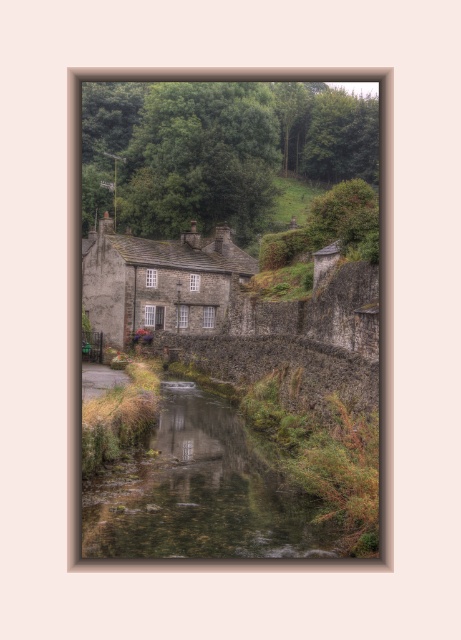
You are standing at the edge of the clear water stream at center and want to reach the rustic stone cottage at center. Which direction should you head to move towards the cottage?

The clear water stream at center is positioned on the right side of rustic stone cottage at center. To reach the cottage, you should move to the left from the stream.

You are standing at the edge of the clear water stream at center. You want to reach the rustic stone cottage at center. Which direction should you head towards?

The clear water stream at center is located below the rustic stone cottage at center, so you should head upwards to reach the rustic stone cottage at center.

You are standing at the origin point of the scene. Where is the clear water stream at center located in terms of coordinates?

The clear water stream at center is located at coordinates point (198,492).